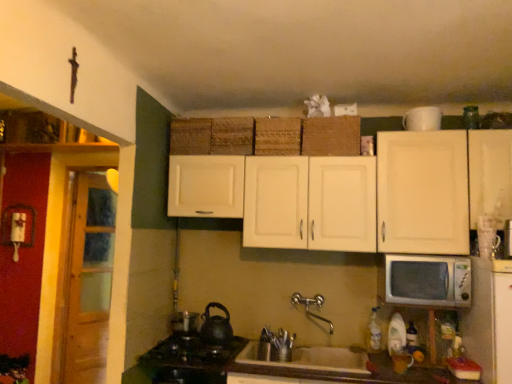
The height and width of the screenshot is (384, 512). Find the location of `free area below black matte tea pot at lower center (from a real-world perspective)`. free area below black matte tea pot at lower center (from a real-world perspective) is located at coordinates click(211, 342).